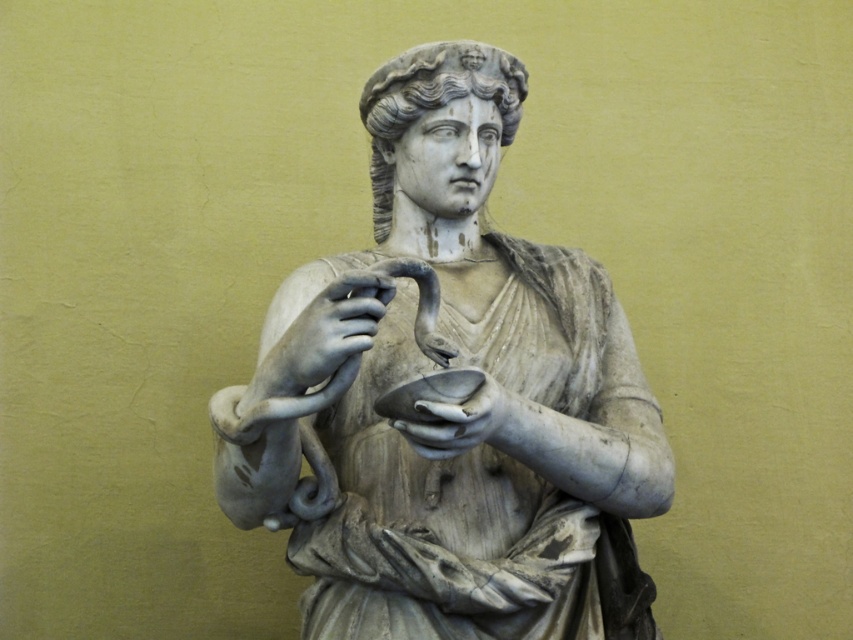
Which is above, white marble snake at center or white marble hand at center?

Positioned higher is white marble snake at center.

Is white marble snake at center positioned at the back of white marble hand at center?

No.

Who is more forward, (276, 323) or (393, 400)?

Positioned in front is point (393, 400).

The width and height of the screenshot is (853, 640). I want to click on white marble snake at center, so coord(318,328).

Does white marble statue at center appear on the left side of white marble hand at center?

In fact, white marble statue at center is to the right of white marble hand at center.

From the picture: How far apart are white marble statue at center and white marble hand at center?

white marble statue at center and white marble hand at center are 3.14 meters apart.

Where is `white marble statue at center`? The width and height of the screenshot is (853, 640). white marble statue at center is located at coordinates (440, 364).

Does white marble statue at center have a greater height compared to white marble snake at center?

Yes.

Identify the location of white marble statue at center. Image resolution: width=853 pixels, height=640 pixels. (440, 364).

Find the location of a particular element. white marble statue at center is located at coordinates (440, 364).